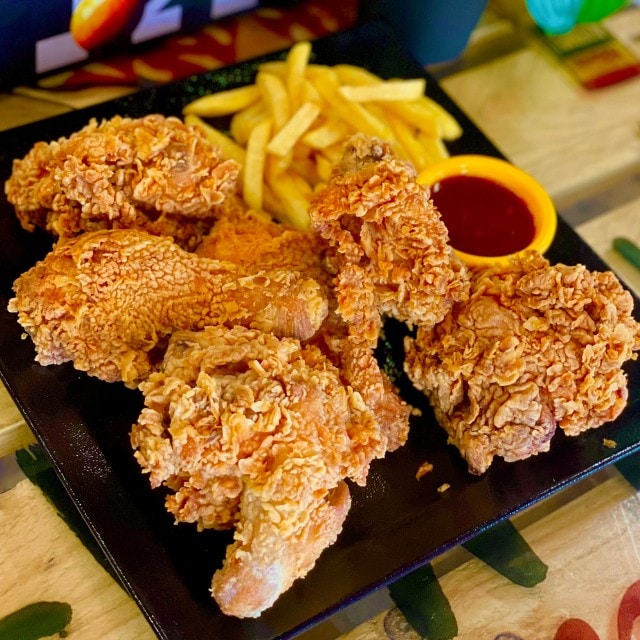
Where is `table`? This screenshot has height=640, width=640. table is located at coordinates (20, 528), (559, 155), (568, 572).